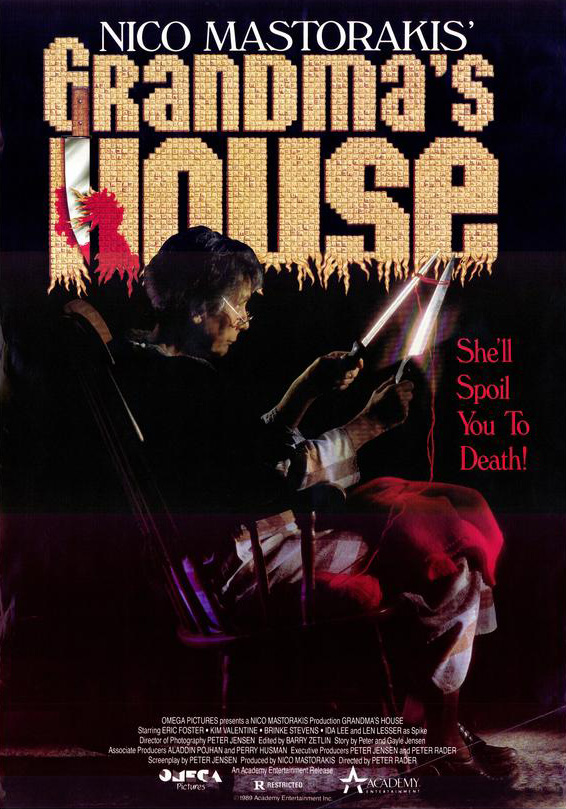
The width and height of the screenshot is (566, 809). Identify the location of swinging chair. (158, 527).